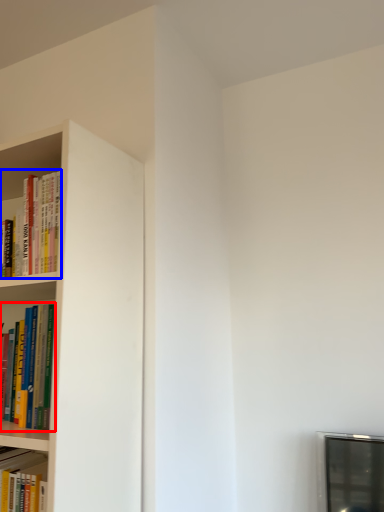
Question: Which of the following is the closest to the observer, book (highlighted by a red box) or book (highlighted by a blue box)?

Choices:
 (A) book
 (B) book

Answer: (A)